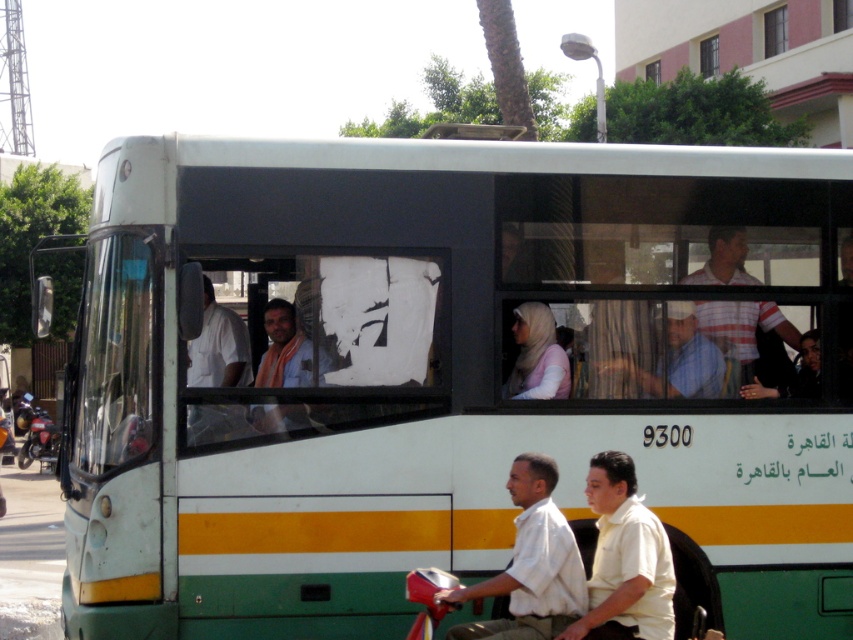
You are a fashion designer observing the two men on bicycles in the scene. Which of the two shirts, the white matte shirt at center or the white cotton shirt at center, would you recommend for a more compact and streamlined look?

The white matte shirt at center has a smaller size compared to the white cotton shirt at center, so it would be more suitable for a compact and streamlined look.